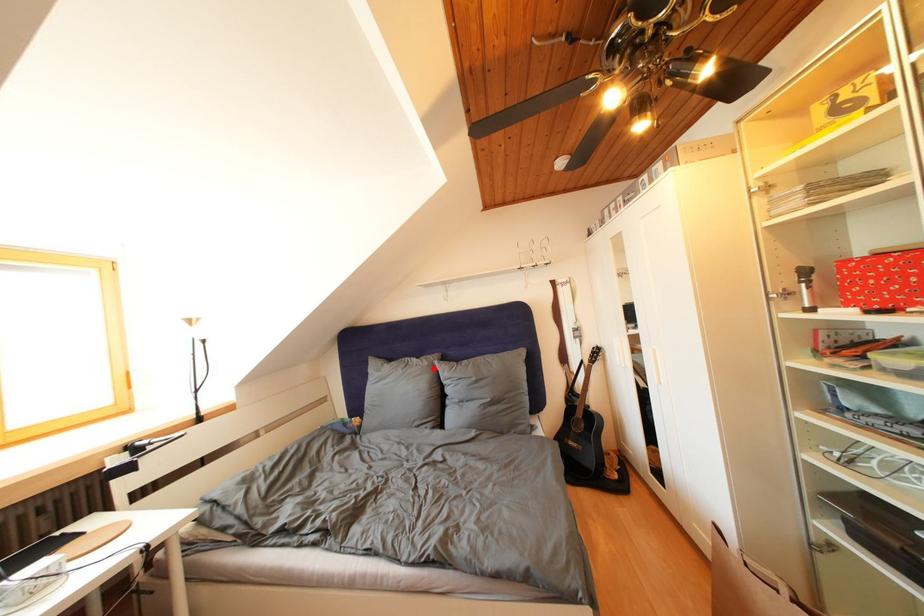
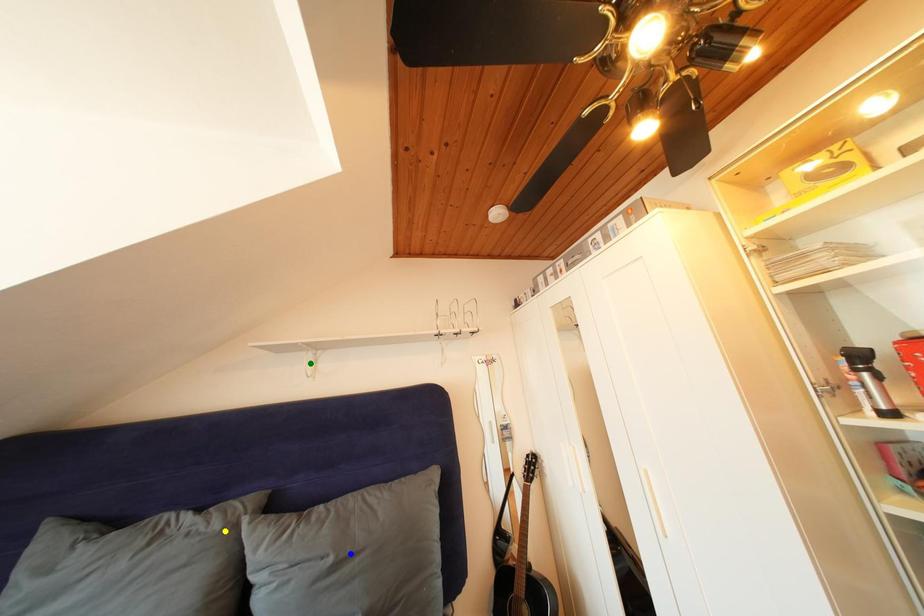
Question: I am providing you with two images of the same scene from different viewpoints. A red point is marked on the first image. You are given multiple points on the second image. Which spot in image 2 lines up with the point in image 1?

Choices:
 (A) green point
 (B) blue point
 (C) yellow point

Answer: (C)